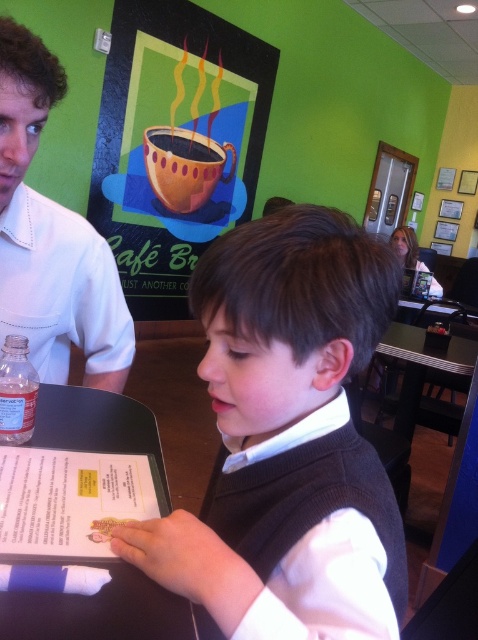
Consider the image. Which of these two, white matte vest at center or white shirt at left, stands taller?

Standing taller between the two is white shirt at left.

From the picture: Who is more distant from viewer, (x=341, y=300) or (x=10, y=273)?

Positioned behind is point (x=10, y=273).

Between point (319, 620) and point (50, 228), which one is positioned in front?

Point (319, 620)

You are a GUI agent. You are given a task and a screenshot of the screen. Output one action in this format:
    pyautogui.click(x=<x>, y=<y>)
    Task: Click on the white matte vest at center
    The width and height of the screenshot is (478, 640).
    Given the screenshot: What is the action you would take?
    pyautogui.click(x=286, y=435)

Is matte coffee cup at upper center positioned before white shirt at left?

That is False.

Is matte coffee cup at upper center below white shirt at left?

Incorrect, matte coffee cup at upper center is not positioned below white shirt at left.

Does point (143, 104) come in front of point (25, 186)?

No, (143, 104) is further to viewer.

Where is `matte coffee cup at upper center`? matte coffee cup at upper center is located at coordinates (175, 144).

Does point (228, 381) come behind point (6, 634)?

Yes, point (228, 381) is farther from viewer.

Is point (308, 556) in front of point (36, 611)?

Yes, it is.

Is point (323, 632) positioned in front of point (74, 625)?

Yes, it is in front of point (74, 625).

Identify the location of white matte vest at center. (286, 435).